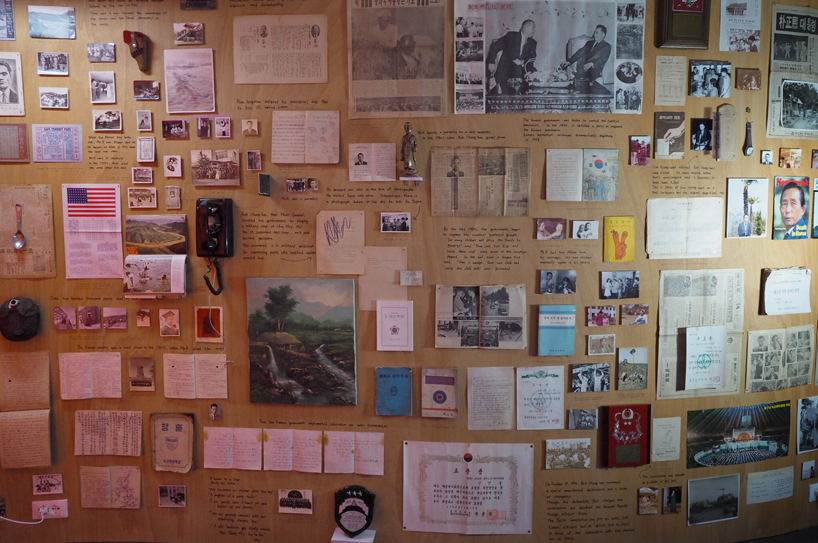
This screenshot has width=818, height=543. What are the coordinates of `plaque` in the screenshot? It's located at (335, 495), (603, 411), (658, 6).